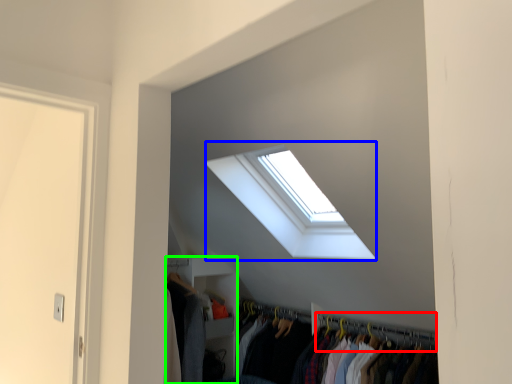
Question: Which is farther away from hanger (highlighted by a red box)? window (highlighted by a blue box) or closet (highlighted by a green box)?

Choices:
 (A) window
 (B) closet

Answer: (A)